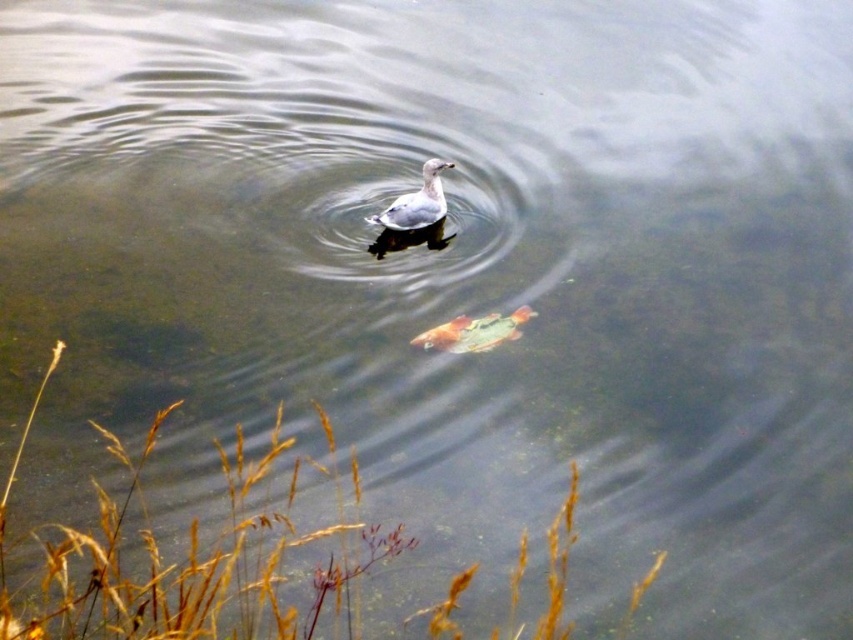
Question: Is shiny orange fish at center below white matte duck at center?

Choices:
 (A) no
 (B) yes

Answer: (B)

Question: Which object is closer to the camera taking this photo?

Choices:
 (A) shiny orange fish at center
 (B) white matte duck at center

Answer: (A)

Question: Which point appears closest to the camera in this image?

Choices:
 (A) (517, 317)
 (B) (416, 227)

Answer: (A)

Question: Is shiny orange fish at center behind white matte duck at center?

Choices:
 (A) no
 (B) yes

Answer: (A)

Question: Considering the relative positions of shiny orange fish at center and white matte duck at center in the image provided, where is shiny orange fish at center located with respect to white matte duck at center?

Choices:
 (A) above
 (B) below

Answer: (B)

Question: Among these points, which one is farthest from the camera?

Choices:
 (A) (526, 320)
 (B) (444, 205)

Answer: (B)